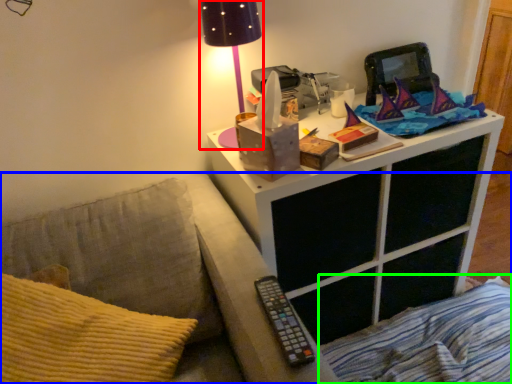
Question: Which object is positioned farthest from table lamp (highlighted by a red box)? Select from furniture (highlighted by a blue box) and bedding (highlighted by a green box).

Choices:
 (A) furniture
 (B) bedding

Answer: (B)